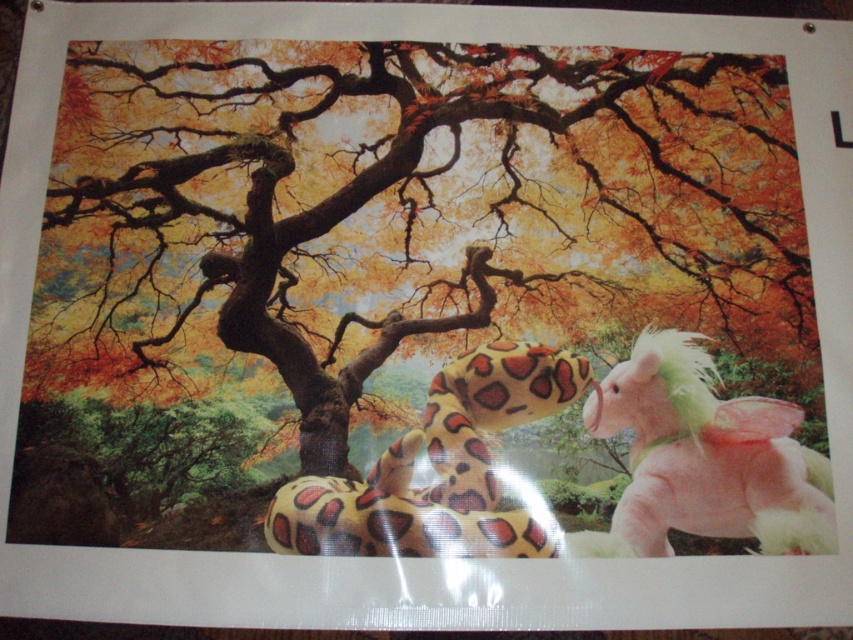
Question: Is autumn leaves at center smaller than fluffy yellow snake at center?

Choices:
 (A) no
 (B) yes

Answer: (A)

Question: Which object appears farthest from the camera in this image?

Choices:
 (A) pink plush toy at right
 (B) fluffy yellow snake at center

Answer: (A)

Question: Which point is farther to the camera?

Choices:
 (A) pink plush toy at right
 (B) fluffy yellow snake at center
 (C) autumn leaves at center

Answer: (C)

Question: Is autumn leaves at center wider than fluffy yellow snake at center?

Choices:
 (A) yes
 (B) no

Answer: (A)

Question: Which point appears closest to the camera in this image?

Choices:
 (A) (149, 260)
 (B) (370, 508)

Answer: (B)

Question: Does pink plush toy at right come behind fluffy yellow snake at center?

Choices:
 (A) yes
 (B) no

Answer: (A)